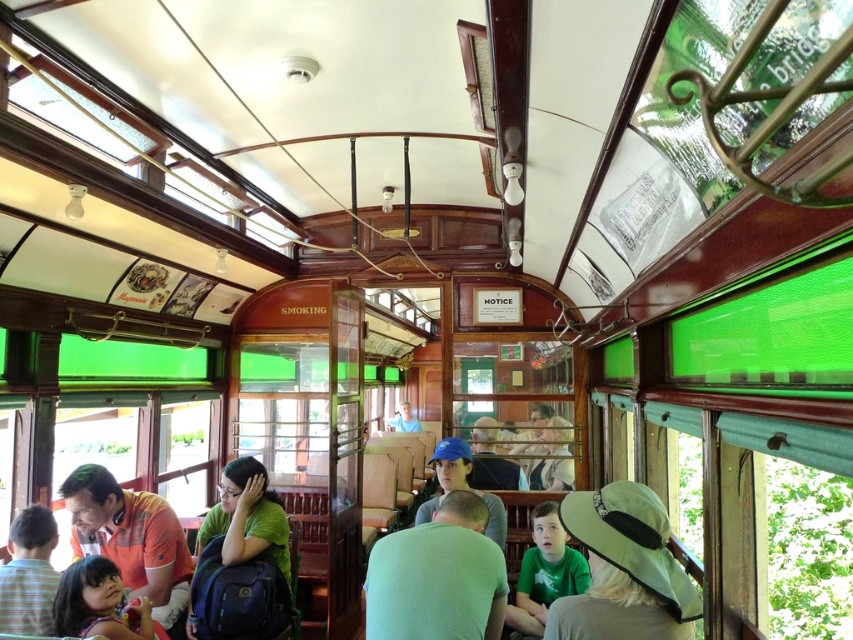
Consider the image. You are a passenger in the vintage tram and notice two passengers wearing a matte orange shirt at lower left and a matte blue shirt at center. Which passenger is standing closer to the ceiling?

The matte orange shirt at lower left is taller than the matte blue shirt at center, so the passenger wearing the matte orange shirt at lower left is standing closer to the ceiling.

Based on the photo, you are a passenger sitting in the vintage tram and notice two green items in front of you. You want to know if you can easily reach both the green matte shirt at center and the green fabric hat at lower center without moving from your seat. Can you determine which item is closer to you?

The green fabric hat at lower center is behind the green matte shirt at center, so the green matte shirt at center is closer to you. You can reach it without moving, but the green fabric hat at lower center might be harder to reach since it is farther back.

You are a photographer standing in the vintage tram car. You want to take a photo of the matte orange shirt at lower left through the camera. Can you do this without moving either the shirt or the camera?

The matte orange shirt at lower left and camera are 2.69 meters apart from each other. Since the distance between them is sufficient for the camera to focus, you can take the photo without moving either the shirt or the camera.